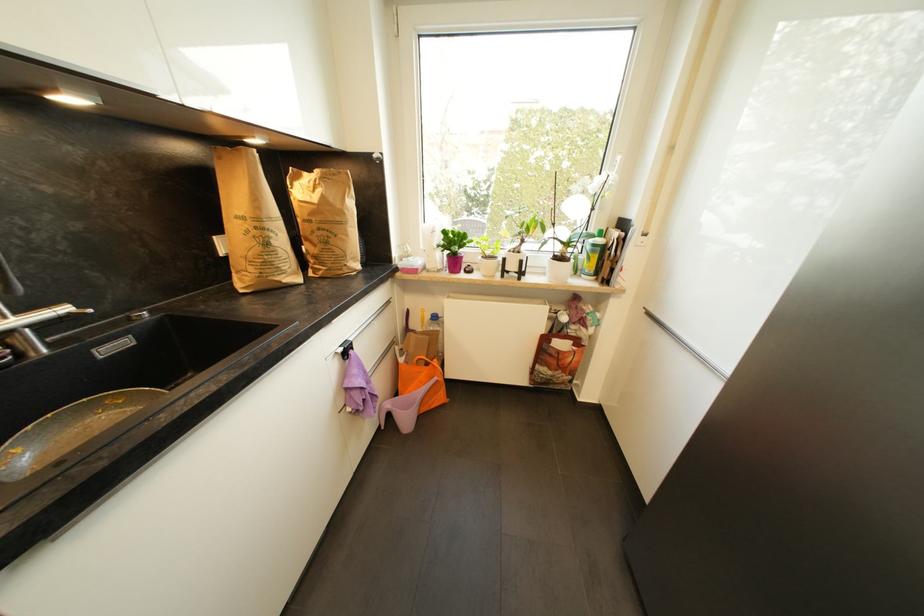
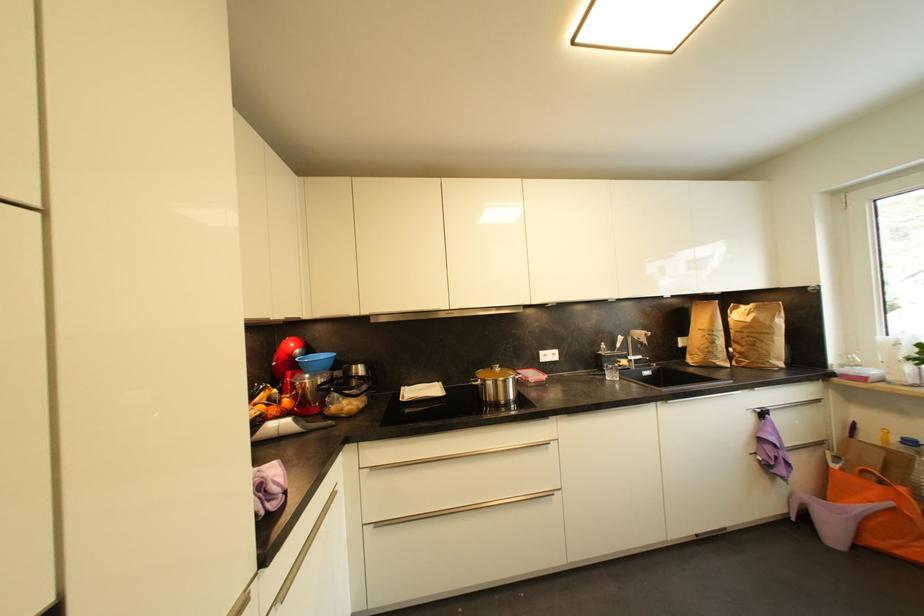
Find the pixel in the second image that matches point 393,407 in the first image.

(811, 498)